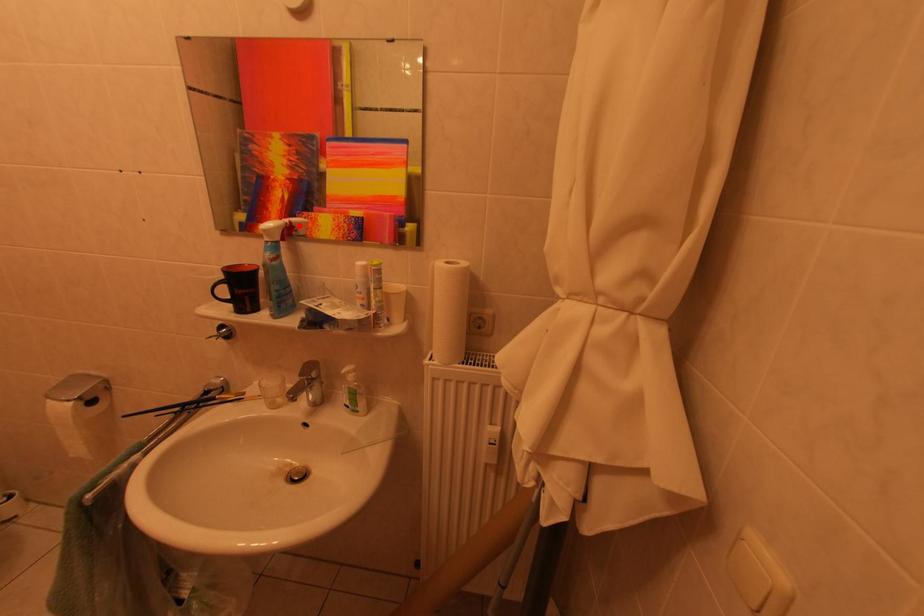
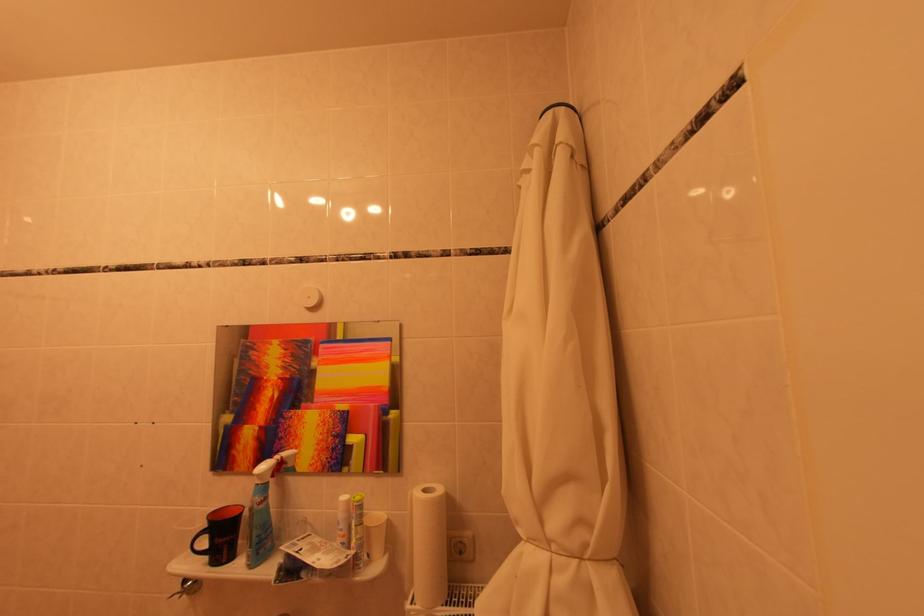
Find the pixel in the second image that matches the highlighted location in the first image.

(290, 461)